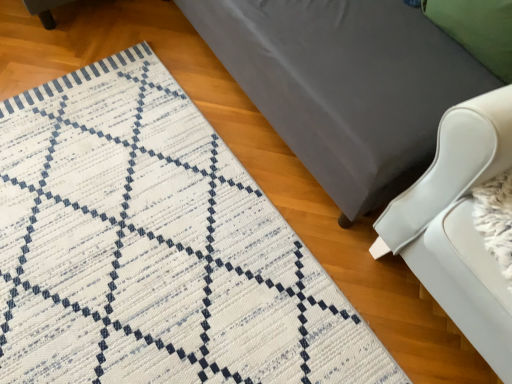
Question: Does point (x=479, y=11) appear closer or farther from the camera than point (x=103, y=360)?

Choices:
 (A) closer
 (B) farther

Answer: (A)

Question: From a real-world perspective, is green fabric pillow at upper right physically located above or below white woven mat at lower left?

Choices:
 (A) above
 (B) below

Answer: (A)

Question: Estimate the real-world distances between objects in this image. Which object is closer to the white woven mat at lower left?

Choices:
 (A) matte gray bed at center
 (B) green fabric pillow at upper right

Answer: (A)

Question: Based on their relative distances, which object is nearer to the green fabric pillow at upper right?

Choices:
 (A) white woven mat at lower left
 (B) matte gray bed at center

Answer: (B)